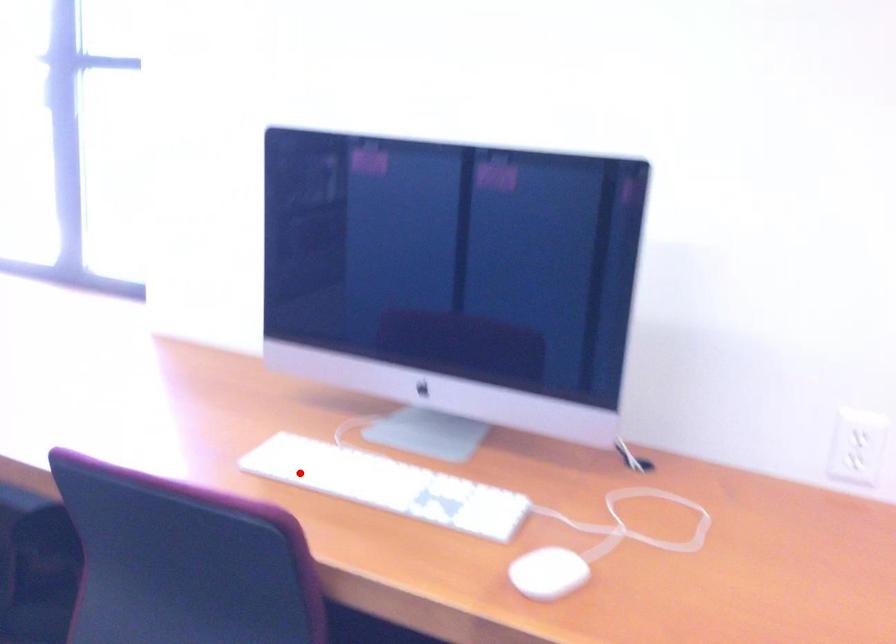
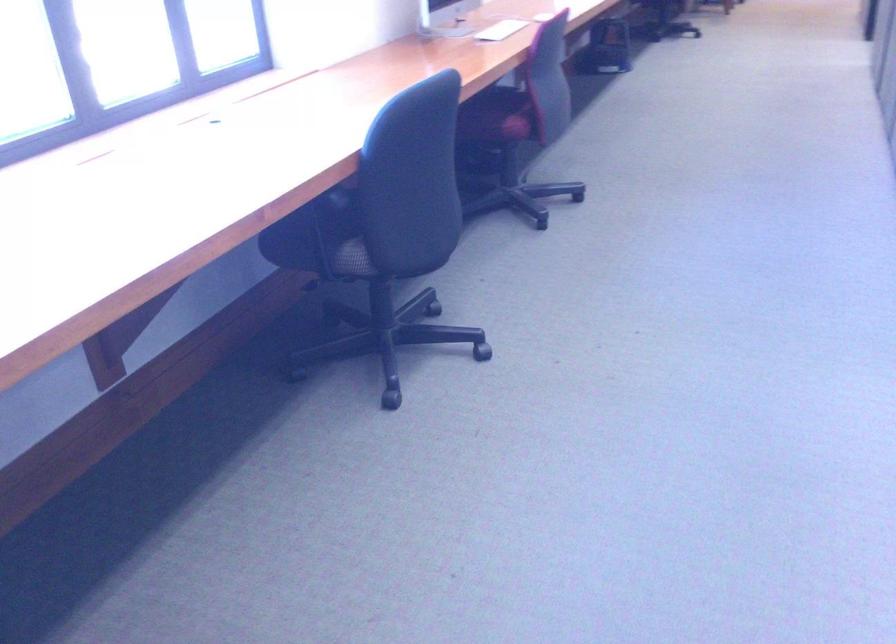
Question: I am providing you with two images of the same scene from different viewpoints. A red point is shown in image1. For the corresponding object point in image2, is it positioned nearer or farther from the camera?

Choices:
 (A) Nearer
 (B) Farther

Answer: (B)